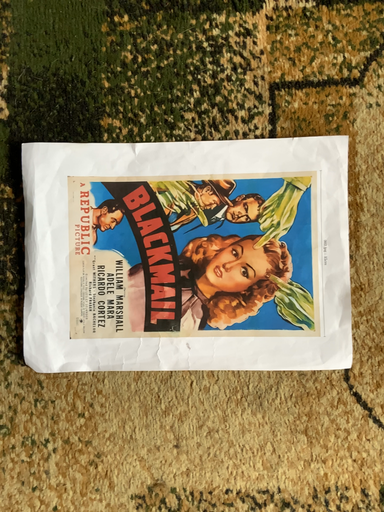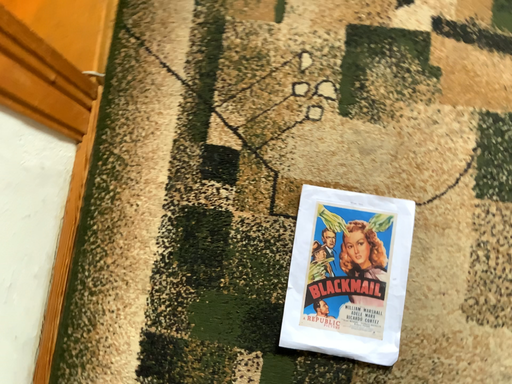
Question: How did the camera likely rotate when shooting the video?

Choices:
 (A) rotated downward
 (B) rotated upward

Answer: (B)